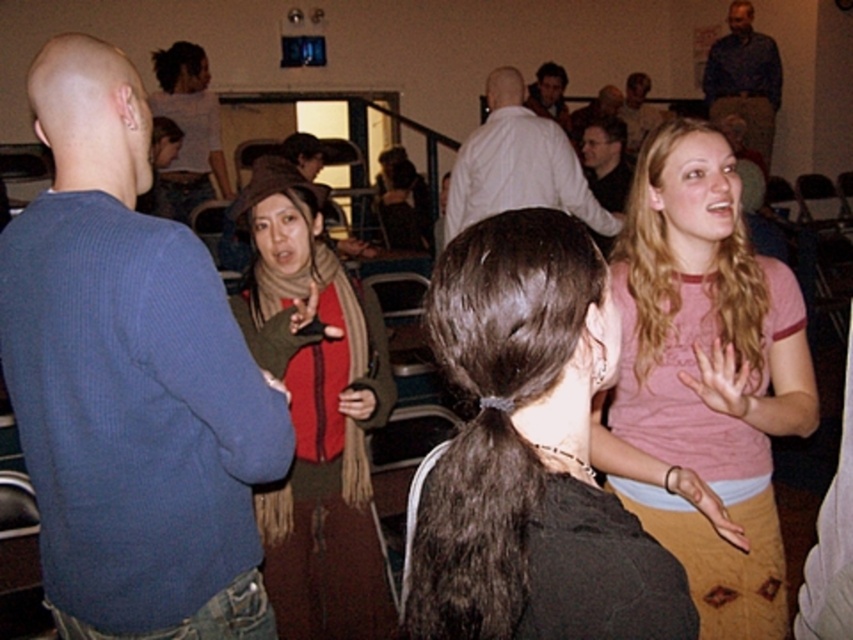
You are standing at the back of the community hall and want to take a photo of the two points marked in the scene. Which point, point (641, 129) or point (560, 67), will appear closer to the camera in your photo?

Point (641, 129) is further to the camera than point (560, 67), so in your photo, point (641, 129) will appear closer to the camera than point (560, 67).

You are attending a community event and notice two people wearing different colored shirts. The smooth brown shirt at upper center and the matte white shirt at center. Which of these two shirts is taller?

The smooth brown shirt at upper center is taller than the matte white shirt at center.